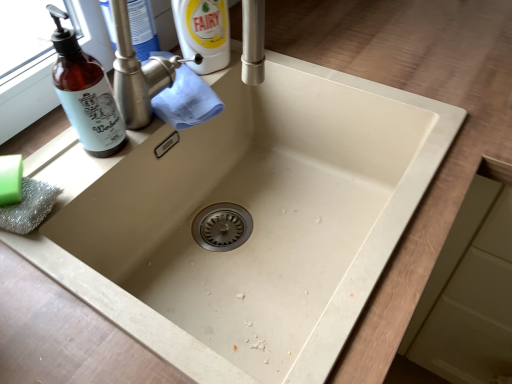
Locate an element on the screen. The width and height of the screenshot is (512, 384). free area in between green matte soap at lower left and brown glass bottle at left is located at coordinates (63, 164).